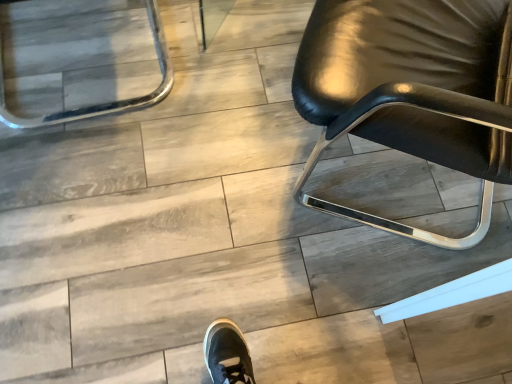
Where is `vacant area situated to the left side of glossy black chair at right, which is counted as the first chair, starting from the right`? The height and width of the screenshot is (384, 512). vacant area situated to the left side of glossy black chair at right, which is counted as the first chair, starting from the right is located at coordinates (209, 148).